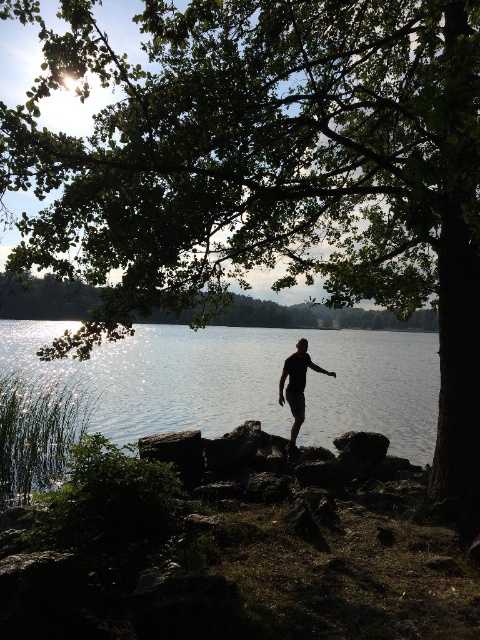
Between clear water at center and black matte shorts at center, which one appears on the right side from the viewer's perspective?

black matte shorts at center is more to the right.

Between clear water at center and black matte shorts at center, which one has less height?

Standing shorter between the two is black matte shorts at center.

Where is `clear water at center`? Image resolution: width=480 pixels, height=640 pixels. clear water at center is located at coordinates pyautogui.click(x=243, y=381).